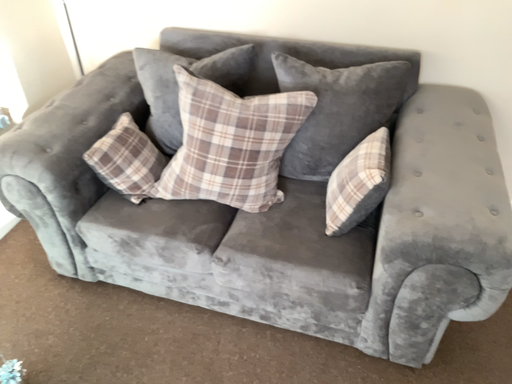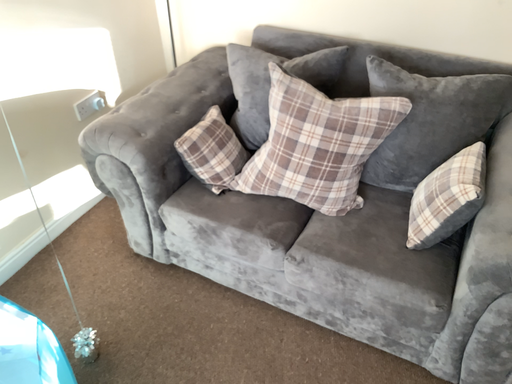
Question: How did the camera likely rotate when shooting the video?

Choices:
 (A) rotated left
 (B) rotated right

Answer: (A)